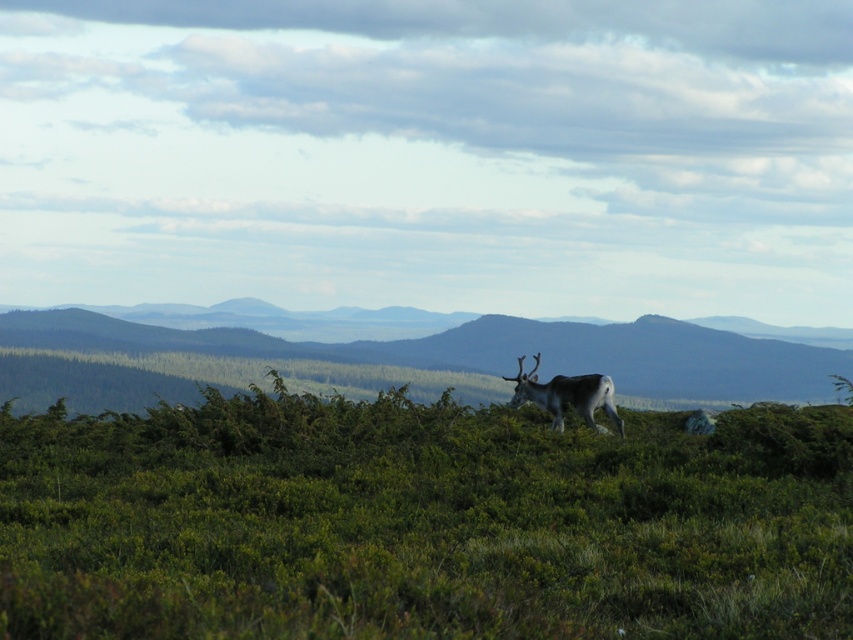
You are standing at the point marked as point (457, 355) in the image. What is the name of the object located exactly at that point?

The green grassy hillside at center is located at point (457, 355).